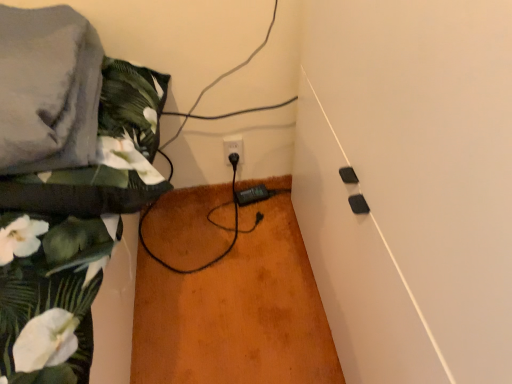
Question: Does black plastic socket at center have a smaller size compared to gray fabric at upper left?

Choices:
 (A) yes
 (B) no

Answer: (A)

Question: Is black plastic socket at center thinner than gray fabric at upper left?

Choices:
 (A) yes
 (B) no

Answer: (A)

Question: Are black plastic socket at center and gray fabric at upper left located far from each other?

Choices:
 (A) no
 (B) yes

Answer: (A)

Question: Can you confirm if black plastic socket at center is positioned to the right of gray fabric at upper left?

Choices:
 (A) no
 (B) yes

Answer: (B)

Question: Can you confirm if black plastic socket at center is taller than gray fabric at upper left?

Choices:
 (A) yes
 (B) no

Answer: (A)

Question: From a real-world perspective, is black plastic socket at center physically above gray fabric at upper left?

Choices:
 (A) no
 (B) yes

Answer: (A)

Question: Is black plastic socket at center completely or partially inside gray fabric at upper left?

Choices:
 (A) yes
 (B) no

Answer: (B)

Question: Can you confirm if gray fabric at upper left is wider than black plastic socket at center?

Choices:
 (A) yes
 (B) no

Answer: (A)

Question: From a real-world perspective, is gray fabric at upper left beneath black plastic socket at center?

Choices:
 (A) no
 (B) yes

Answer: (A)

Question: Is gray fabric at upper left touching black plastic socket at center?

Choices:
 (A) no
 (B) yes

Answer: (A)

Question: Is gray fabric at upper left turned away from black plastic socket at center?

Choices:
 (A) no
 (B) yes

Answer: (A)

Question: From the image's perspective, would you say gray fabric at upper left is positioned over black plastic socket at center?

Choices:
 (A) yes
 (B) no

Answer: (A)

Question: From the image's perspective, is black plastic socket at center on floral fabric at left?

Choices:
 (A) yes
 (B) no

Answer: (B)